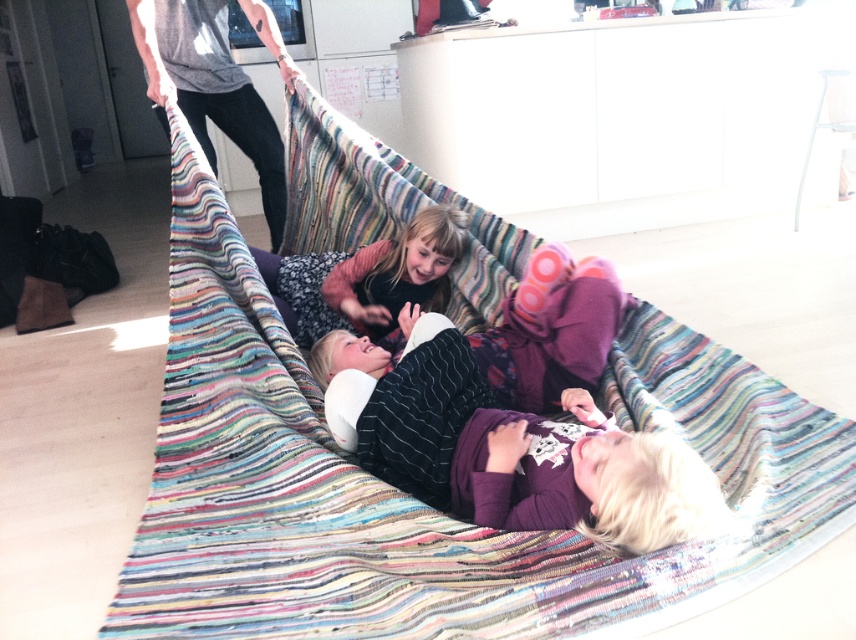
You are a parent standing in the room and see the purple soft fabric at center. Can you reach it without moving your feet?

The purple soft fabric at center is 1.43 meters from viewer, which is farther than an average adult arm length of about 0.7 meters. So you cannot reach it without moving your feet.

You are a parent trying to decide which item to grab first to cover a child. The purple soft fabric at center and the matte black shirt at center are both within reach. Which one is lower and easier to grab?

The purple soft fabric at center has a lesser height compared to matte black shirt at center, so it is lower and easier to grab.